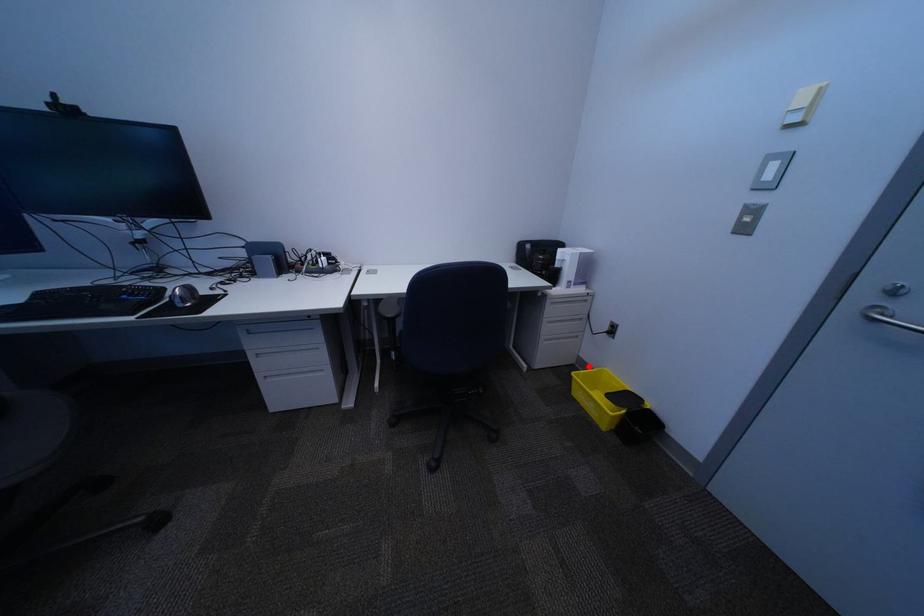
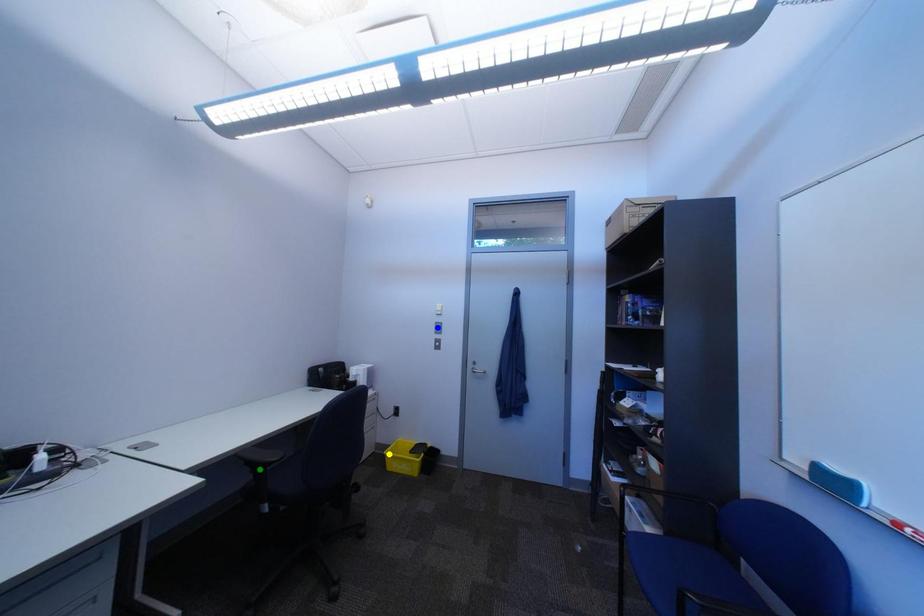
Question: I am providing you with two images of the same scene from different viewpoints. A red point is marked on the first image. You are given multiple points on the second image. Which mark in image 2 goes with the point in image 1?

Choices:
 (A) green point
 (B) yellow point
 (C) blue point

Answer: (B)